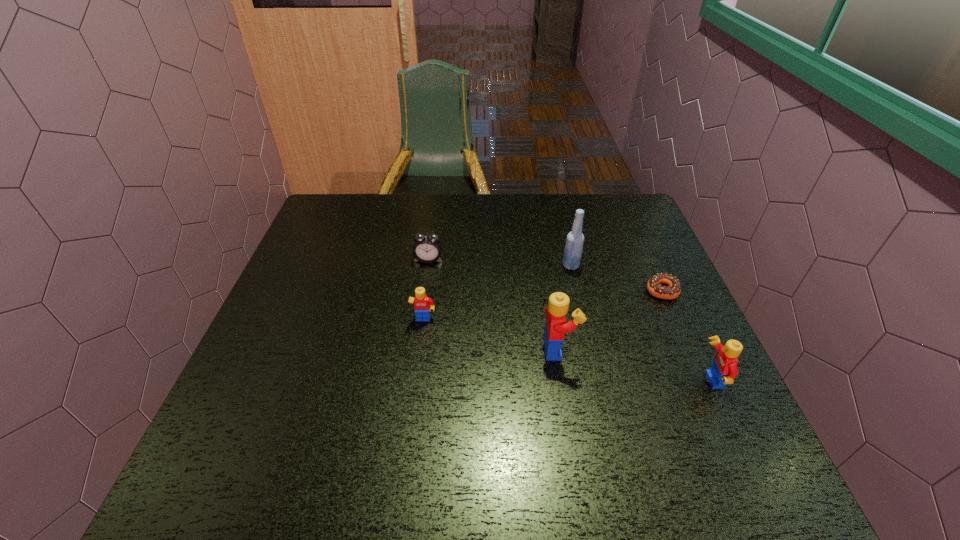
This screenshot has height=540, width=960. What are the coordinates of `blank space at the far edge` in the screenshot? It's located at (420, 202).

In the image, there is a desktop. Where is `vacant area at the near edge`? The height and width of the screenshot is (540, 960). vacant area at the near edge is located at coordinates (329, 416).

You are a GUI agent. You are given a task and a screenshot of the screen. Output one action in this format:
    pyautogui.click(x=<x>, y=<y>)
    Task: Click on the vacant space at the left edge
    Image resolution: width=960 pixels, height=540 pixels.
    Given the screenshot: What is the action you would take?
    pyautogui.click(x=291, y=338)

The width and height of the screenshot is (960, 540). Find the location of `vacant area at the right edge of the desktop`. vacant area at the right edge of the desktop is located at coordinates (646, 341).

I want to click on free region at the near left corner of the desktop, so click(252, 407).

Where is `vacant space at the far right corner of the desktop`? The width and height of the screenshot is (960, 540). vacant space at the far right corner of the desktop is located at coordinates (634, 232).

The image size is (960, 540). Find the location of `free space at the near right corner of the desktop`. free space at the near right corner of the desktop is located at coordinates (712, 434).

Image resolution: width=960 pixels, height=540 pixels. In order to click on free spot between the bottle and the alarm clock in this screenshot , I will do `click(499, 262)`.

At what (x,y) coordinates should I click in order to perform the action: click on free space between the second shortest Lego and the alarm clock. Please return your answer as a coordinate pair (x, y). This screenshot has width=960, height=540. Looking at the image, I should click on (569, 320).

The image size is (960, 540). I want to click on vacant area that lies between the bottle and the rightmost Lego, so click(640, 323).